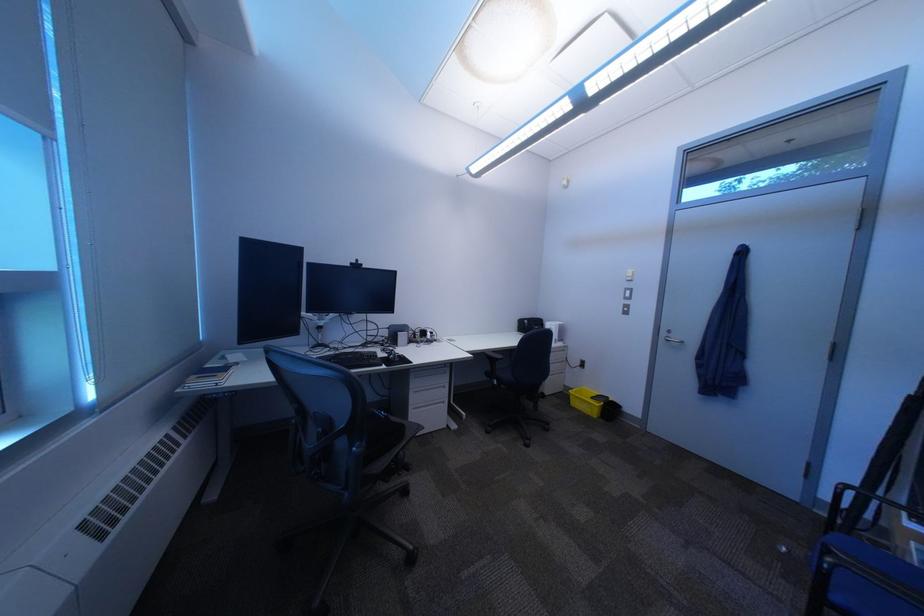
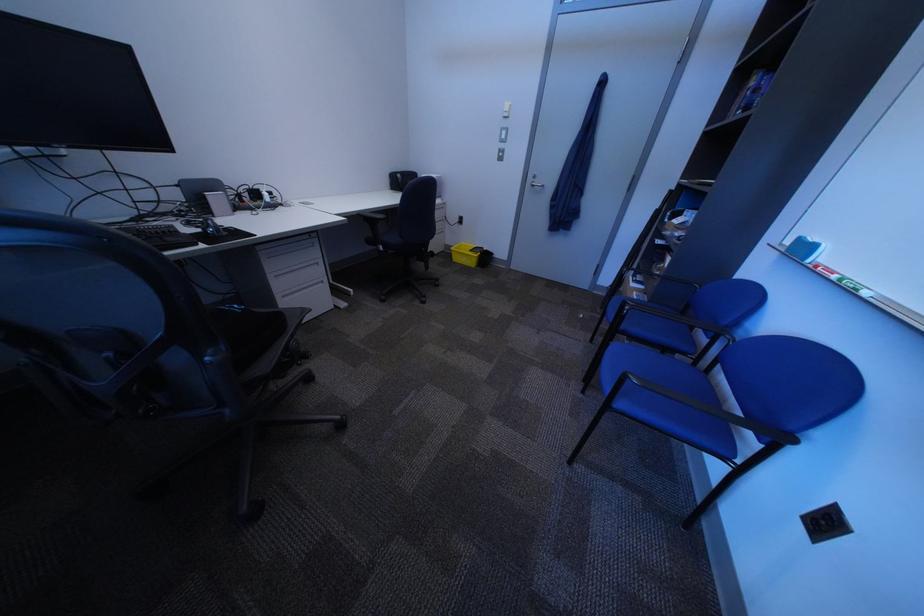
In the second image, find the point that corresponds to (x=805, y=554) in the first image.

(599, 318)